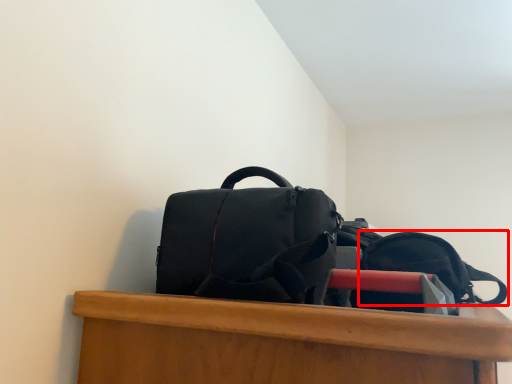
Question: From the image's perspective, what is the correct spatial positioning of backpack (annotated by the red box) in reference to backpack?

Choices:
 (A) above
 (B) below

Answer: (B)